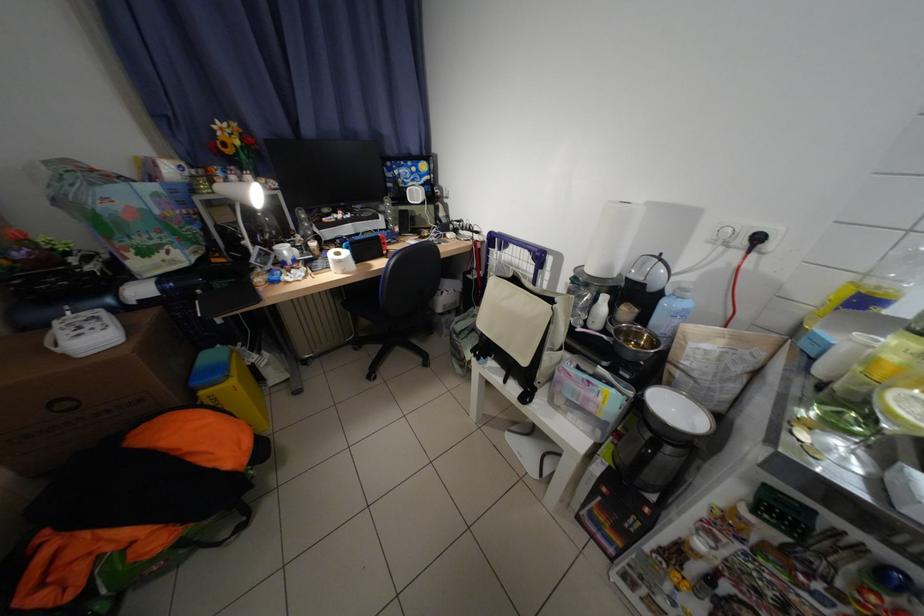
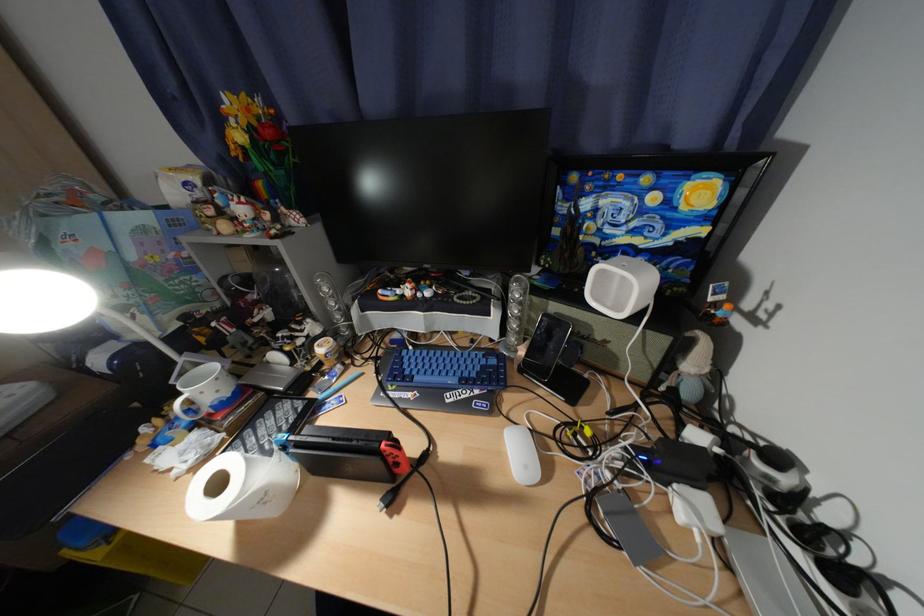
Where in the second image is the point corresponding to the point at 454,215 from the first image?

(704, 367)